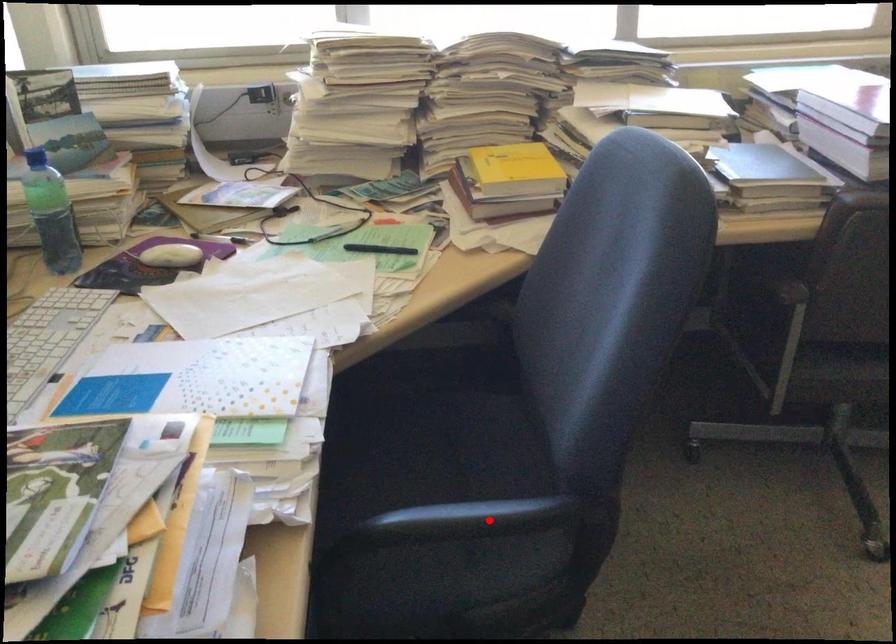
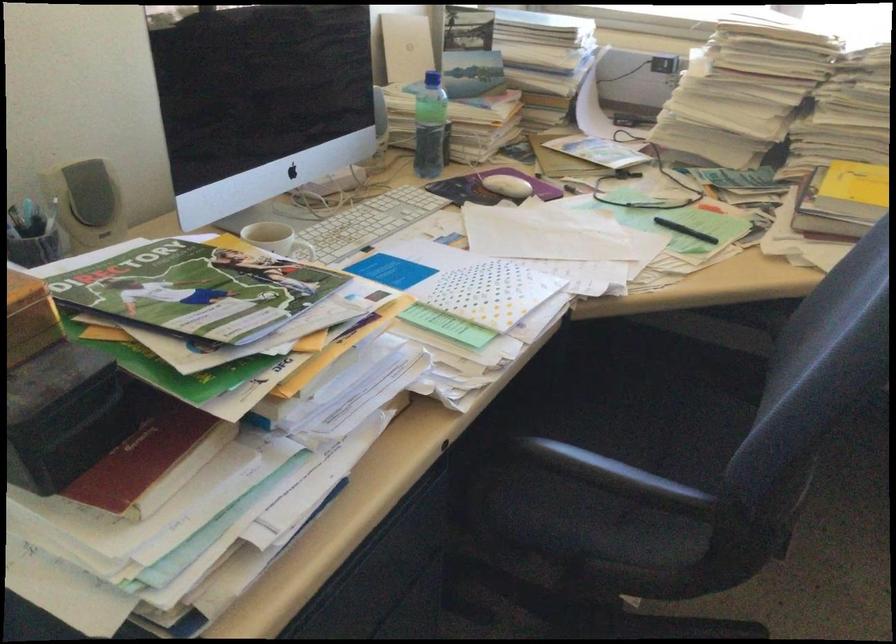
Find the pixel in the second image that matches the highlighted location in the first image.

(614, 474)